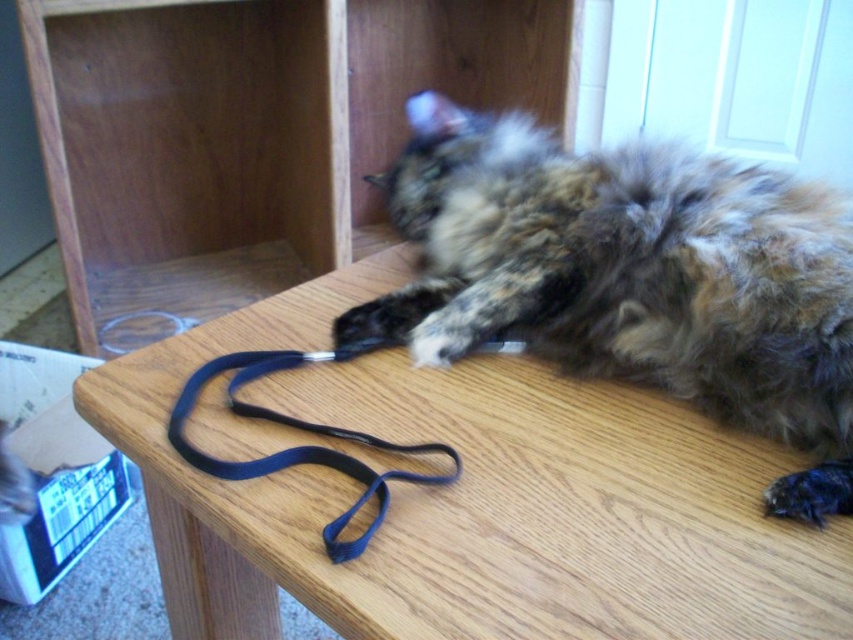
You are holding a 12 inch ruler and looking at the wooden table at center in the image. Can you determine if the ruler would fit entirely on the table without hanging off the edge?

The wooden table at center is 16.47 inches from camera, so the ruler would fit entirely on the table without hanging off the edge since it is shorter than the table length.

Based on the scene description, where is the wooden table at center located in terms of coordinates?

The wooden table at center is located at point (471, 499).